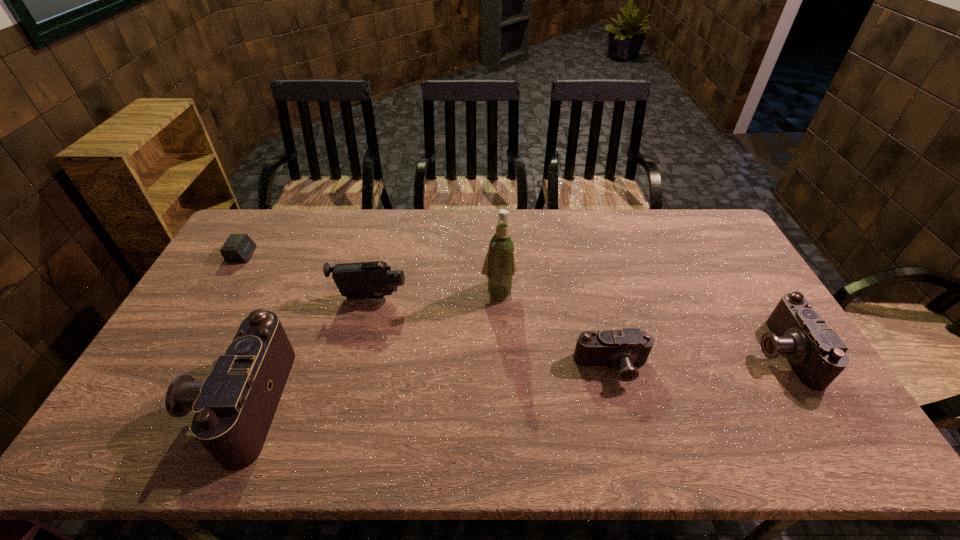
You are a GUI agent. You are given a task and a screenshot of the screen. Output one action in this format:
    pyautogui.click(x=<x>, y=<y>)
    Task: Click on the leftmost camera
    
    Given the screenshot: What is the action you would take?
    pyautogui.click(x=234, y=407)

You are a GUI agent. You are given a task and a screenshot of the screen. Output one action in this format:
    pyautogui.click(x=<x>, y=<y>)
    Task: Click on the tallest camera
    
    Given the screenshot: What is the action you would take?
    pyautogui.click(x=234, y=407)

Identify the location of the shortest camera. The width and height of the screenshot is (960, 540). (626, 348).

In order to click on the second camera from left to right in this screenshot , I will do `click(626, 348)`.

Where is `the rightmost object`? Image resolution: width=960 pixels, height=540 pixels. the rightmost object is located at coordinates (816, 353).

In order to click on the fourth tallest object in this screenshot , I will do `click(816, 353)`.

The image size is (960, 540). Identify the location of the leftmost object. (238, 247).

This screenshot has width=960, height=540. What are the coordinates of `alarm clock` in the screenshot? It's located at (238, 247).

Locate an element on the screen. Image resolution: width=960 pixels, height=540 pixels. camcorder is located at coordinates (364, 280).

I want to click on the fourth object from left to right, so click(x=499, y=266).